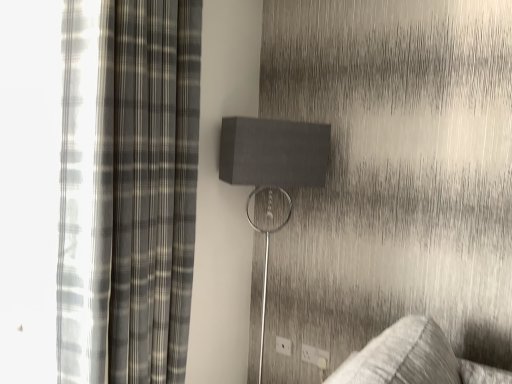
Question: Is white plastic electric outlet at lower center, marked as the third electric outlet in a front-to-back arrangement, outside white plastic electric outlet at lower right, placed as the third electric outlet when sorted from left to right?

Choices:
 (A) yes
 (B) no

Answer: (A)

Question: Does white plastic electric outlet at lower center, which is counted as the 1th electric outlet, starting from the back, have a smaller size compared to white plastic electric outlet at lower right, marked as the 1th electric outlet in a front-to-back arrangement?

Choices:
 (A) yes
 (B) no

Answer: (B)

Question: Does white plastic electric outlet at lower center, marked as the third electric outlet in a front-to-back arrangement, appear on the left side of white plastic electric outlet at lower right, marked as the 1th electric outlet in a front-to-back arrangement?

Choices:
 (A) yes
 (B) no

Answer: (A)

Question: From a real-world perspective, does white plastic electric outlet at lower center, marked as the third electric outlet in a front-to-back arrangement, sit lower than white plastic electric outlet at lower right, acting as the 3th electric outlet starting from the back?

Choices:
 (A) yes
 (B) no

Answer: (B)

Question: Does white plastic electric outlet at lower center, the 3th electric outlet from the right, have a lesser height compared to white plastic electric outlet at lower right, placed as the third electric outlet when sorted from left to right?

Choices:
 (A) yes
 (B) no

Answer: (B)

Question: Would you say white plastic electric outlet at lower right, acting as the 3th electric outlet starting from the back, is part of white plastic electric outlet at lower center, the 3th electric outlet from the right,'s contents?

Choices:
 (A) no
 (B) yes

Answer: (A)

Question: Is matte gray speaker at center positioned behind plaid fabric curtain at left?

Choices:
 (A) no
 (B) yes

Answer: (B)

Question: Does matte gray speaker at center have a greater height compared to plaid fabric curtain at left?

Choices:
 (A) no
 (B) yes

Answer: (A)

Question: Does matte gray speaker at center turn towards plaid fabric curtain at left?

Choices:
 (A) no
 (B) yes

Answer: (A)

Question: Can you confirm if matte gray speaker at center is shorter than plaid fabric curtain at left?

Choices:
 (A) yes
 (B) no

Answer: (A)

Question: From a real-world perspective, is matte gray speaker at center over plaid fabric curtain at left?

Choices:
 (A) yes
 (B) no

Answer: (B)

Question: Is matte gray speaker at center wider than plaid fabric curtain at left?

Choices:
 (A) yes
 (B) no

Answer: (A)

Question: Considering the relative positions of white plastic electric outlet at lower right, marked as the 1th electric outlet in a front-to-back arrangement, and white plastic electric outlet at lower center, the 1th electric outlet when ordered from left to right, in the image provided, is white plastic electric outlet at lower right, marked as the 1th electric outlet in a front-to-back arrangement, to the right of white plastic electric outlet at lower center, the 1th electric outlet when ordered from left to right, from the viewer's perspective?

Choices:
 (A) yes
 (B) no

Answer: (A)